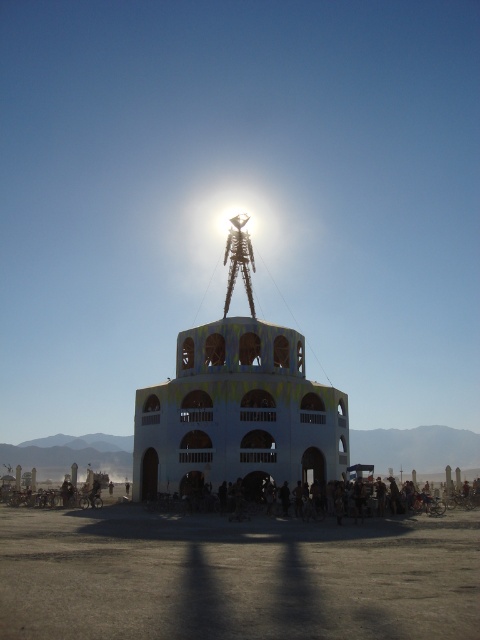
Does dirt field at center have a lesser height compared to white painted wood tower at center?

Yes, dirt field at center is shorter than white painted wood tower at center.

Between dirt field at center and white painted wood tower at center, which one is positioned lower?

dirt field at center is lower down.

Find the location of a particular element. dirt field at center is located at coordinates (236, 576).